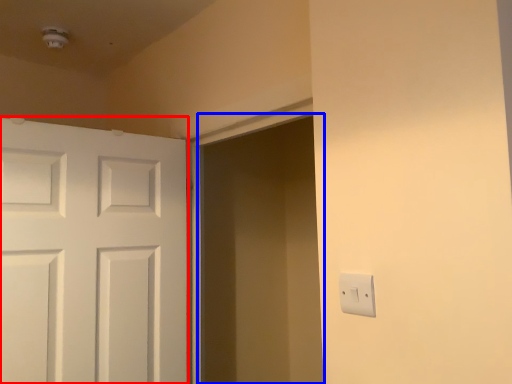
Question: Which point is further to the camera, door (highlighted by a red box) or screen door (highlighted by a blue box)?

Choices:
 (A) door
 (B) screen door

Answer: (A)